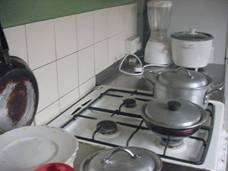
The image size is (228, 171). Identify the location of plate. (66, 152).